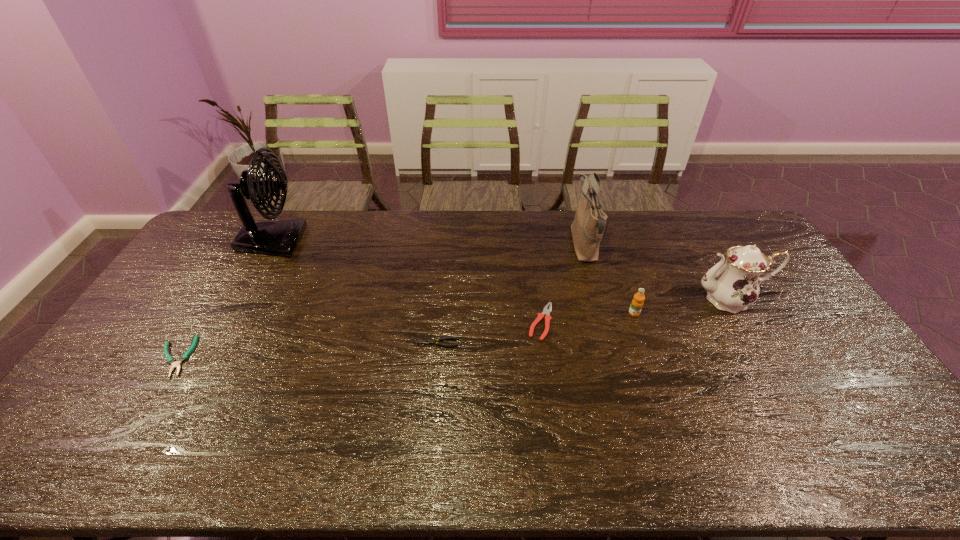
Where is `free spot located on the front of the third object from left to right`? The image size is (960, 540). free spot located on the front of the third object from left to right is located at coordinates (431, 404).

Where is `vacant space located on the right of the leftmost pliers`? Image resolution: width=960 pixels, height=540 pixels. vacant space located on the right of the leftmost pliers is located at coordinates (303, 356).

Find the location of a particular element. The image size is (960, 540). fan that is at the far edge is located at coordinates (280, 237).

Locate an element on the screen. The width and height of the screenshot is (960, 540). shoulder bag at the far edge is located at coordinates (587, 228).

The height and width of the screenshot is (540, 960). Identify the location of fan present at the left edge. (280, 237).

Where is `pliers that is at the left edge`? This screenshot has width=960, height=540. pliers that is at the left edge is located at coordinates (170, 360).

Image resolution: width=960 pixels, height=540 pixels. I want to click on object present at the right edge, so click(731, 287).

Where is `object present at the far left corner`? The height and width of the screenshot is (540, 960). object present at the far left corner is located at coordinates (280, 237).

This screenshot has width=960, height=540. In order to click on vacant space at the far edge of the desktop in this screenshot , I will do `click(308, 214)`.

Locate an element on the screen. Image resolution: width=960 pixels, height=540 pixels. vacant region at the near edge of the desktop is located at coordinates (177, 458).